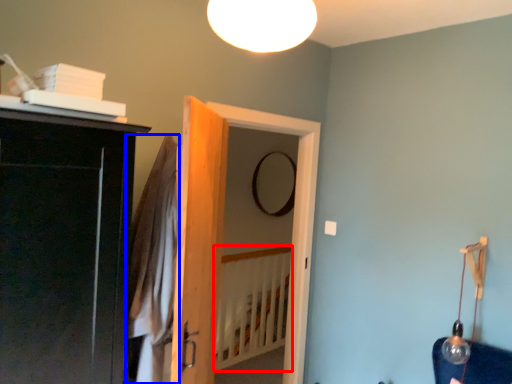
Question: Which point is closer to the camera, bed frame (highlighted by a red box) or robe (highlighted by a blue box)?

Choices:
 (A) bed frame
 (B) robe

Answer: (B)